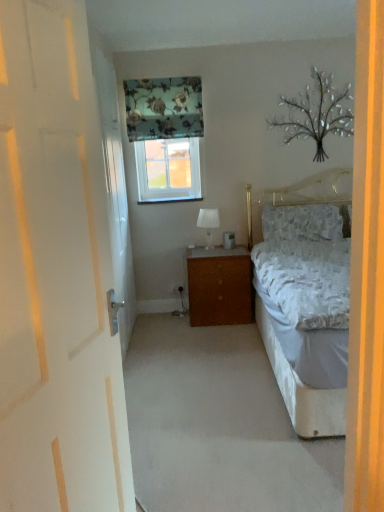
Question: Does metallic silver tree at upper right appear on the left side of floral fabric curtain at upper center?

Choices:
 (A) yes
 (B) no

Answer: (B)

Question: Can we say metallic silver tree at upper right lies outside floral fabric curtain at upper center?

Choices:
 (A) yes
 (B) no

Answer: (A)

Question: Is metallic silver tree at upper right to the right of floral fabric curtain at upper center from the viewer's perspective?

Choices:
 (A) no
 (B) yes

Answer: (B)

Question: Considering the relative sizes of metallic silver tree at upper right and floral fabric curtain at upper center in the image provided, is metallic silver tree at upper right smaller than floral fabric curtain at upper center?

Choices:
 (A) no
 (B) yes

Answer: (B)

Question: Is there a large distance between metallic silver tree at upper right and floral fabric curtain at upper center?

Choices:
 (A) yes
 (B) no

Answer: (B)

Question: Does metallic silver tree at upper right have a lesser height compared to floral fabric curtain at upper center?

Choices:
 (A) yes
 (B) no

Answer: (B)

Question: From a real-world perspective, is fluffy white pillow at center on metallic silver tree at upper right?

Choices:
 (A) no
 (B) yes

Answer: (A)

Question: Is fluffy white pillow at center beside metallic silver tree at upper right?

Choices:
 (A) yes
 (B) no

Answer: (B)

Question: Is fluffy white pillow at center further to camera compared to metallic silver tree at upper right?

Choices:
 (A) no
 (B) yes

Answer: (B)

Question: From the image's perspective, is fluffy white pillow at center on metallic silver tree at upper right?

Choices:
 (A) no
 (B) yes

Answer: (A)

Question: Is fluffy white pillow at center positioned beyond the bounds of metallic silver tree at upper right?

Choices:
 (A) no
 (B) yes

Answer: (B)

Question: Considering the relative positions of fluffy white pillow at center and metallic silver tree at upper right in the image provided, is fluffy white pillow at center to the left of metallic silver tree at upper right from the viewer's perspective?

Choices:
 (A) no
 (B) yes

Answer: (B)

Question: Does metallic silver tree at upper right appear on the left side of white fabric lampshade at center?

Choices:
 (A) yes
 (B) no

Answer: (B)